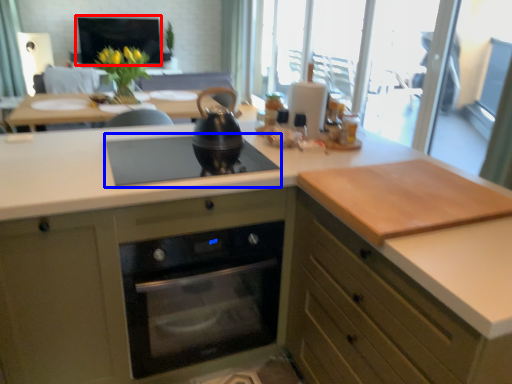
Question: Which of the following is the farthest to the observer, window screen (highlighted by a red box) or gas stove (highlighted by a blue box)?

Choices:
 (A) window screen
 (B) gas stove

Answer: (A)